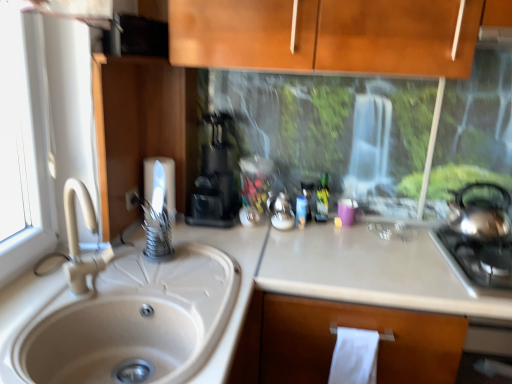
Question: Is the surface of white matte countertop at center in direct contact with stainless steel gas stove at right?

Choices:
 (A) yes
 (B) no

Answer: (B)

Question: Is white matte countertop at center closer to camera compared to stainless steel gas stove at right?

Choices:
 (A) yes
 (B) no

Answer: (A)

Question: Can you confirm if white matte countertop at center is bigger than stainless steel gas stove at right?

Choices:
 (A) yes
 (B) no

Answer: (A)

Question: Is stainless steel gas stove at right completely or partially inside white matte countertop at center?

Choices:
 (A) yes
 (B) no

Answer: (A)

Question: Is white matte countertop at center aimed at stainless steel gas stove at right?

Choices:
 (A) no
 (B) yes

Answer: (A)

Question: From the image's perspective, relative to white paper towel at lower center, which is counted as the second toilet paper, starting from the left, is white matte sink at left above or below?

Choices:
 (A) below
 (B) above

Answer: (B)

Question: In the image, is white matte sink at left on the left side or the right side of white paper towel at lower center, which is counted as the second toilet paper, starting from the left?

Choices:
 (A) right
 (B) left

Answer: (B)

Question: Is white matte sink at left inside the boundaries of white paper towel at lower center, which is counted as the first toilet paper, starting from the front, or outside?

Choices:
 (A) outside
 (B) inside

Answer: (A)

Question: Considering the positions of white matte sink at left and white paper towel at lower center, which is counted as the second toilet paper, starting from the left, in the image, is white matte sink at left bigger or smaller than white paper towel at lower center, which is counted as the second toilet paper, starting from the left,?

Choices:
 (A) small
 (B) big

Answer: (B)

Question: From a real-world perspective, relative to green matte bottle at center, is satin silver tea pot at right vertically above or below?

Choices:
 (A) above
 (B) below

Answer: (A)

Question: Is point (465, 226) closer or farther from the camera than point (324, 173)?

Choices:
 (A) closer
 (B) farther

Answer: (A)

Question: Looking at their shapes, would you say satin silver tea pot at right is wider or thinner than green matte bottle at center?

Choices:
 (A) thin
 (B) wide

Answer: (B)

Question: Relative to green matte bottle at center, is satin silver tea pot at right in front or behind?

Choices:
 (A) front
 (B) behind

Answer: (A)

Question: Choose the correct answer: Is white matte countertop at center inside white matte sink at left or outside it?

Choices:
 (A) inside
 (B) outside

Answer: (B)

Question: In terms of size, does white matte countertop at center appear bigger or smaller than white matte sink at left?

Choices:
 (A) big
 (B) small

Answer: (A)